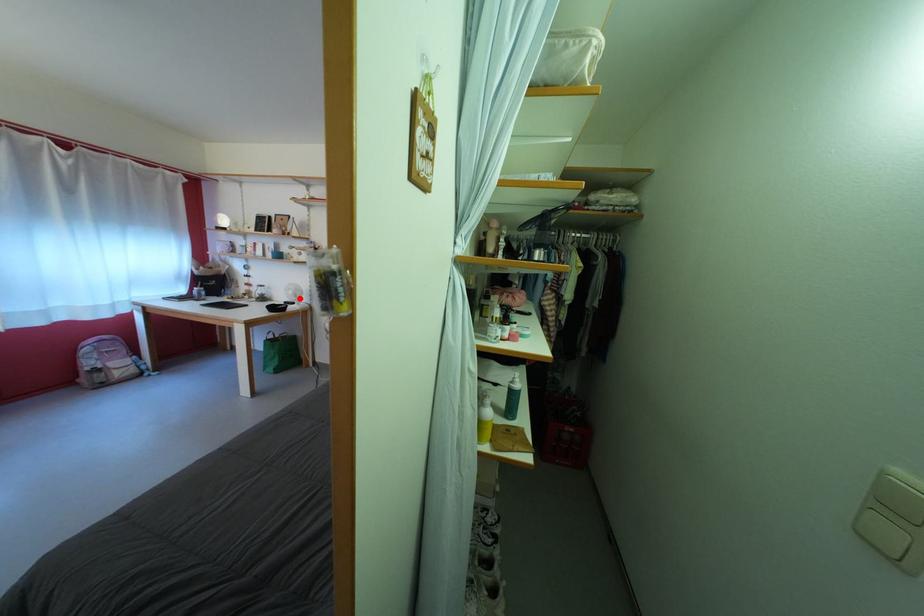
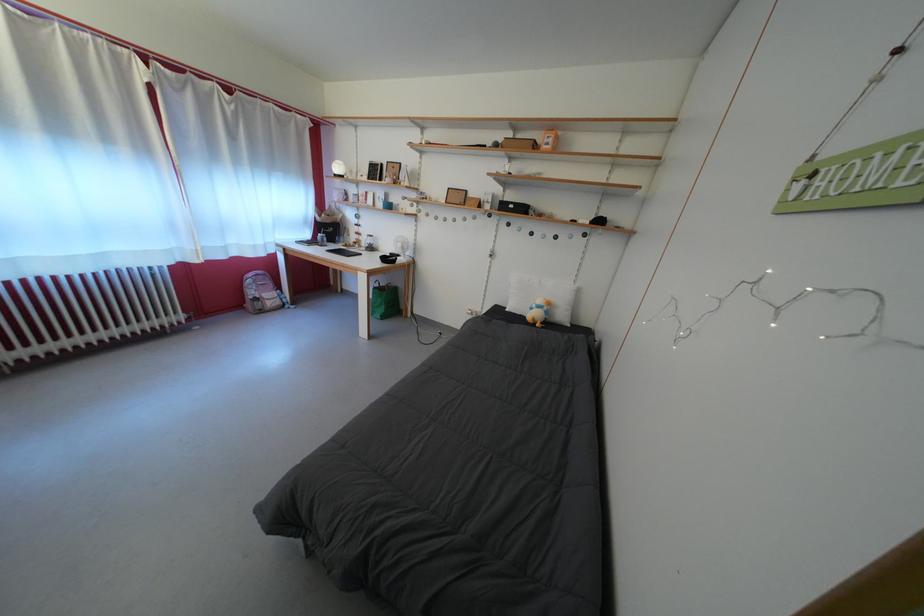
Question: I am providing you with two images of the same scene from different viewpoints. A red point is shown in image1. For the corresponding object point in image2, is it positioned nearer or farther from the camera?

Choices:
 (A) Nearer
 (B) Farther

Answer: (A)